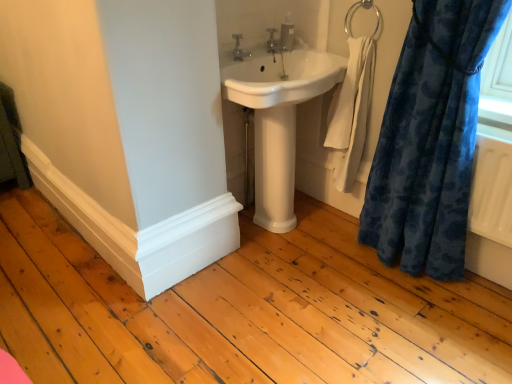
Question: Is matte silver faucet at upper center, the second tap from the left, beside white glossy sink at center?

Choices:
 (A) yes
 (B) no

Answer: (B)

Question: Is matte silver faucet at upper center, the second tap positioned from the front, far away from white glossy sink at center?

Choices:
 (A) yes
 (B) no

Answer: (B)

Question: From a real-world perspective, is matte silver faucet at upper center, which ranks as the 1th tap in right-to-left order, below white glossy sink at center?

Choices:
 (A) no
 (B) yes

Answer: (A)

Question: Is matte silver faucet at upper center, which ranks as the 1th tap in back-to-front order, positioned behind white glossy sink at center?

Choices:
 (A) yes
 (B) no

Answer: (A)

Question: Is matte silver faucet at upper center, the second tap from the left, positioned beyond the bounds of white glossy sink at center?

Choices:
 (A) no
 (B) yes

Answer: (A)

Question: From their relative heights in the image, would you say white cotton towel at right is taller or shorter than matte silver faucet at upper center, the second tap positioned from the front?

Choices:
 (A) tall
 (B) short

Answer: (A)

Question: Is point (345, 102) closer or farther from the camera than point (268, 46)?

Choices:
 (A) closer
 (B) farther

Answer: (A)

Question: From a real-world perspective, relative to matte silver faucet at upper center, the second tap positioned from the front, is white cotton towel at right vertically above or below?

Choices:
 (A) above
 (B) below

Answer: (B)

Question: Considering the positions of white cotton towel at right and matte silver faucet at upper center, the second tap positioned from the front, in the image, is white cotton towel at right bigger or smaller than matte silver faucet at upper center, the second tap positioned from the front,?

Choices:
 (A) small
 (B) big

Answer: (B)

Question: Considering the positions of white glossy sink at center and satin silver soap dispenser at upper center in the image, is white glossy sink at center bigger or smaller than satin silver soap dispenser at upper center?

Choices:
 (A) small
 (B) big

Answer: (B)

Question: From a real-world perspective, relative to satin silver soap dispenser at upper center, is white glossy sink at center vertically above or below?

Choices:
 (A) below
 (B) above

Answer: (A)

Question: Which is correct: white glossy sink at center is inside satin silver soap dispenser at upper center, or outside of it?

Choices:
 (A) inside
 (B) outside

Answer: (B)

Question: In terms of width, does white glossy sink at center look wider or thinner when compared to satin silver soap dispenser at upper center?

Choices:
 (A) thin
 (B) wide

Answer: (B)

Question: From their relative heights in the image, would you say velvety blue curtain at right is taller or shorter than white glossy pedestal at center?

Choices:
 (A) short
 (B) tall

Answer: (B)

Question: Considering the positions of velvety blue curtain at right and white glossy pedestal at center in the image, is velvety blue curtain at right wider or thinner than white glossy pedestal at center?

Choices:
 (A) wide
 (B) thin

Answer: (A)